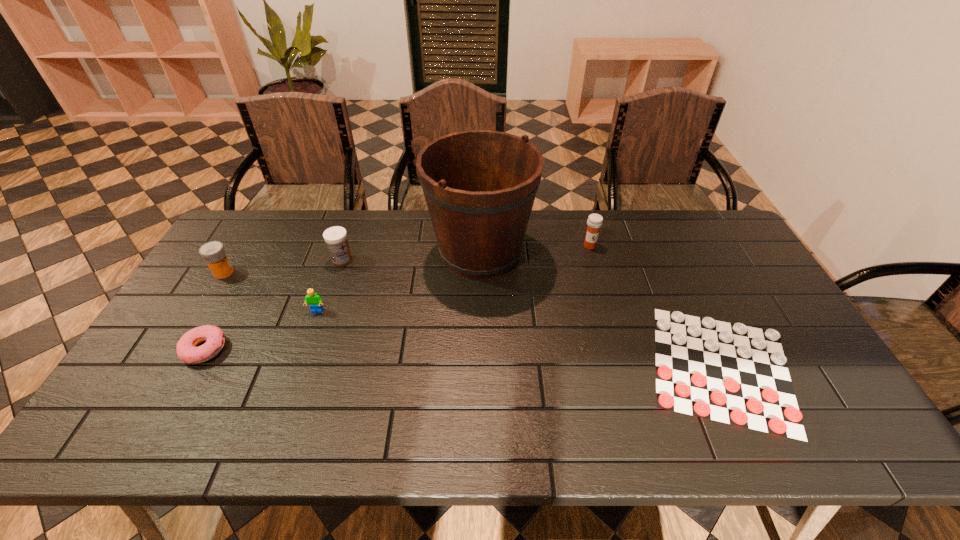
Locate an element on the screen. The height and width of the screenshot is (540, 960). vacant space located 0.120m on the left of the tallest object is located at coordinates (390, 252).

Find the location of a particular element. This screenshot has width=960, height=540. free point located 0.390m on the label side of the rightmost medicine is located at coordinates (617, 345).

Identify the location of vacant space located on the left of the second medicine from left to right. This screenshot has height=540, width=960. (248, 260).

You are a GUI agent. You are given a task and a screenshot of the screen. Output one action in this format:
    pyautogui.click(x=<x>, y=<y>)
    Task: Click on the blank space located on the label side of the leftmost medicine
    This screenshot has width=960, height=540.
    Given the screenshot: What is the action you would take?
    pyautogui.click(x=342, y=272)

In order to click on free region located 0.250m on the face of the third shortest object in this screenshot , I will do `click(289, 392)`.

You are a GUI agent. You are given a task and a screenshot of the screen. Output one action in this format:
    pyautogui.click(x=<x>, y=<y>)
    Task: Click on the vacant space located on the front of the sixth tallest object
    
    Given the screenshot: What is the action you would take?
    pyautogui.click(x=173, y=407)

The width and height of the screenshot is (960, 540). In order to click on free point located 0.140m on the back of the shortest object in this screenshot , I will do `click(679, 275)`.

Find the location of a particular element. The width and height of the screenshot is (960, 540). bucket positioned at the far edge is located at coordinates (479, 185).

The height and width of the screenshot is (540, 960). Find the location of `object at the near edge`. object at the near edge is located at coordinates (731, 373).

Where is `medicine present at the left edge`? medicine present at the left edge is located at coordinates (213, 253).